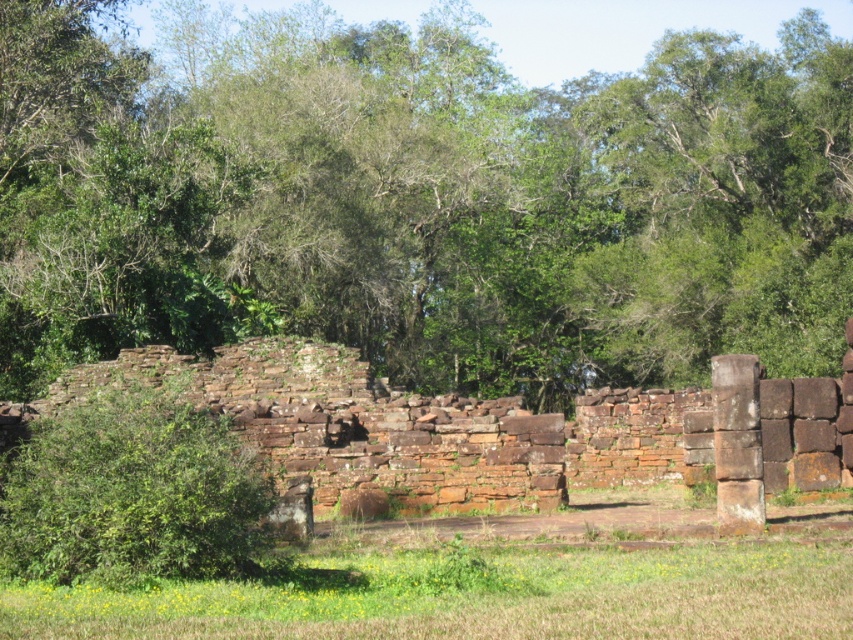
Question: Which object is the closest to the green grass at lower center?

Choices:
 (A) brown stone ruins at center
 (B) green leafy bush at left

Answer: (B)

Question: Which object is positioned closest to the brown stone ruins at center?

Choices:
 (A) green leafy bush at left
 (B) green leafy tree at center
 (C) green grass at lower center

Answer: (A)

Question: From the image, what is the correct spatial relationship of green grass at lower center in relation to green leafy bush at left?

Choices:
 (A) right
 (B) left

Answer: (A)

Question: Does green leafy tree at center appear on the left side of brown stone ruins at center?

Choices:
 (A) yes
 (B) no

Answer: (A)

Question: Estimate the real-world distances between objects in this image. Which object is closer to the green leafy bush at left?

Choices:
 (A) brown stone ruins at center
 (B) green leafy tree at center
 (C) green grass at lower center

Answer: (C)

Question: Can you confirm if green leafy tree at center is wider than brown stone ruins at center?

Choices:
 (A) yes
 (B) no

Answer: (A)